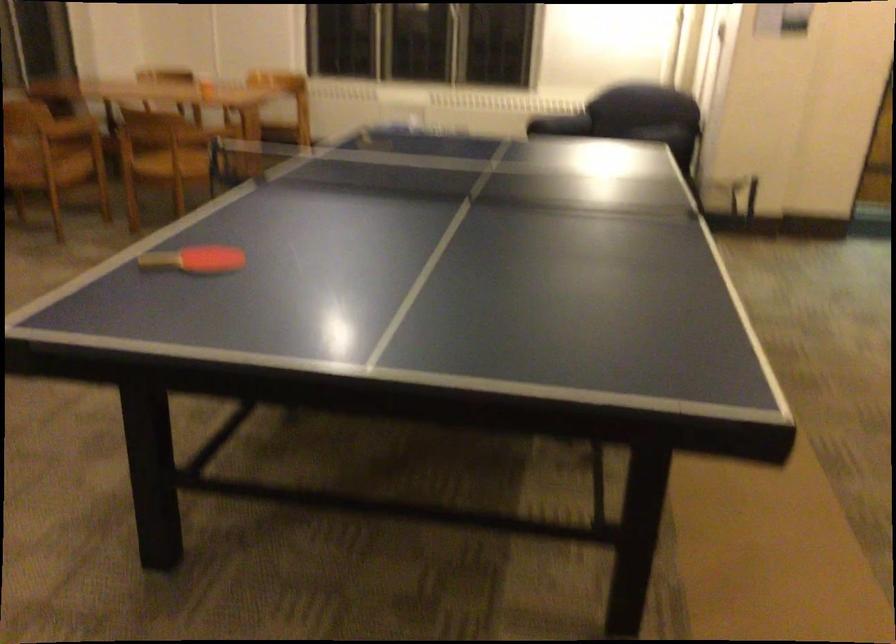
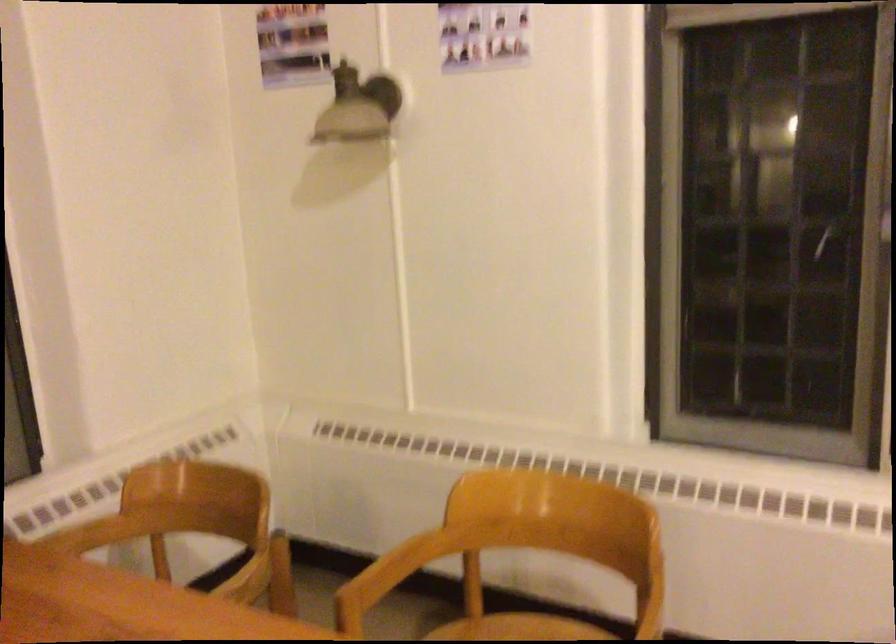
Locate, in the second image, the point that corresponds to (286,118) in the first image.

(517, 629)